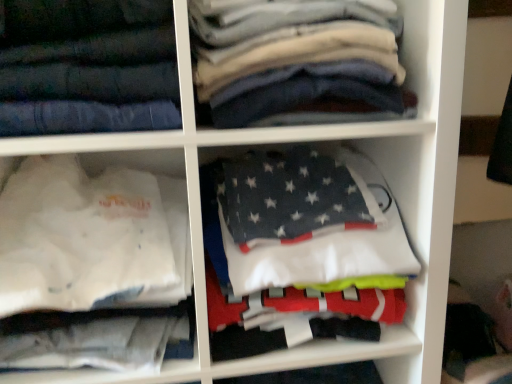
Question: Is dark blue denim jeans at upper left at the left side of dark gray fleece blanket at center, the 2th cabinet in the left-to-right sequence?

Choices:
 (A) yes
 (B) no

Answer: (A)

Question: Is dark blue denim jeans at upper left closer to the viewer compared to dark gray fleece blanket at center, the 2th cabinet in the left-to-right sequence?

Choices:
 (A) no
 (B) yes

Answer: (B)

Question: Considering the relative positions of dark blue denim jeans at upper left and dark gray fleece blanket at center, the 2th cabinet in the left-to-right sequence, in the image provided, is dark blue denim jeans at upper left to the right of dark gray fleece blanket at center, the 2th cabinet in the left-to-right sequence, from the viewer's perspective?

Choices:
 (A) no
 (B) yes

Answer: (A)

Question: From the image's perspective, is dark blue denim jeans at upper left under dark gray fleece blanket at center, the first cabinet positioned from the right?

Choices:
 (A) yes
 (B) no

Answer: (B)

Question: From a real-world perspective, is dark blue denim jeans at upper left physically below dark gray fleece blanket at center, the first cabinet positioned from the right?

Choices:
 (A) no
 (B) yes

Answer: (A)

Question: Could dark gray fleece blanket at center, the first cabinet positioned from the right, be considered to be inside dark blue denim jeans at upper left?

Choices:
 (A) yes
 (B) no

Answer: (B)

Question: From a real-world perspective, is dark gray cotton shirts at upper center on top of dark blue denim jeans at upper left?

Choices:
 (A) yes
 (B) no

Answer: (B)

Question: Does dark gray cotton shirts at upper center lie behind dark blue denim jeans at upper left?

Choices:
 (A) no
 (B) yes

Answer: (B)

Question: From the image's perspective, is dark gray cotton shirts at upper center on top of dark blue denim jeans at upper left?

Choices:
 (A) yes
 (B) no

Answer: (A)

Question: Does dark gray cotton shirts at upper center have a lesser height compared to dark blue denim jeans at upper left?

Choices:
 (A) no
 (B) yes

Answer: (B)

Question: From a real-world perspective, is dark gray cotton shirts at upper center under dark blue denim jeans at upper left?

Choices:
 (A) no
 (B) yes

Answer: (B)

Question: Considering the relative positions of dark gray cotton shirts at upper center and dark blue denim jeans at upper left in the image provided, is dark gray cotton shirts at upper center to the right of dark blue denim jeans at upper left from the viewer's perspective?

Choices:
 (A) no
 (B) yes

Answer: (B)

Question: Is dark gray cotton shirts at upper center to the left of dark gray fleece blanket at center, the 2th cabinet in the left-to-right sequence, from the viewer's perspective?

Choices:
 (A) no
 (B) yes

Answer: (B)